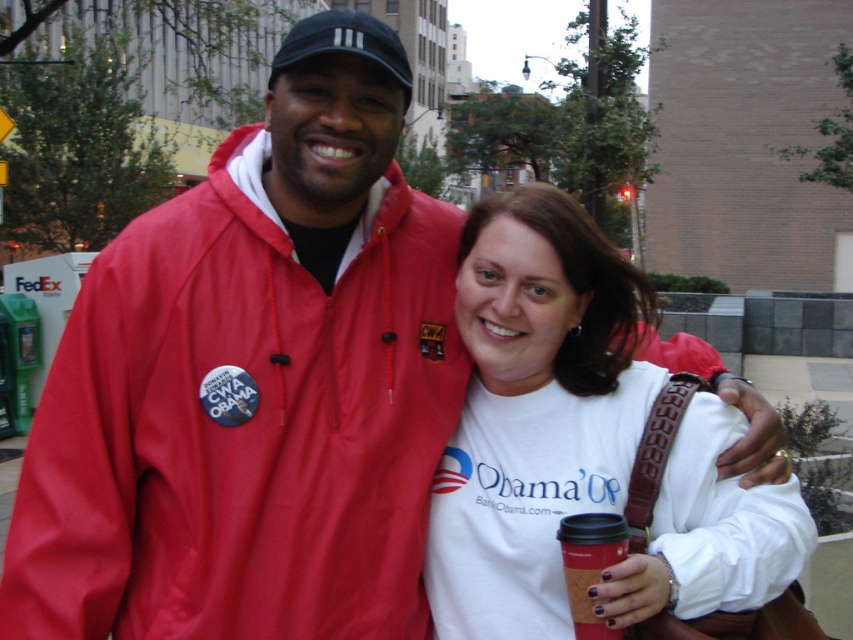
You are a photographer trying to capture the matte red jacket at center in your shot. Given that the camera frame is centered at point 0.5 in both x and y coordinates, will the jacket be in the center of the frame?

The matte red jacket at center is located at point (x=241, y=428), which is offset from the frame center at 0.5, so it will not be perfectly centered in the shot.